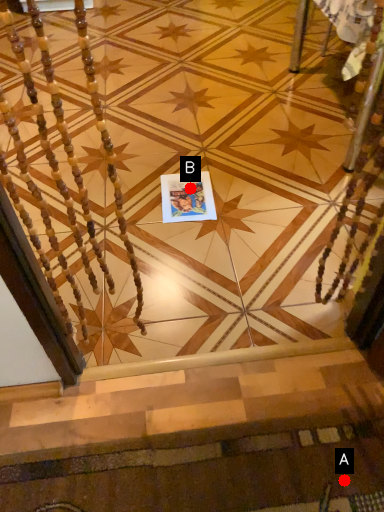
Question: Two points are circled on the image, labeled by A and B beside each circle. Which point is closer to the camera?

Choices:
 (A) A is closer
 (B) B is closer

Answer: (A)